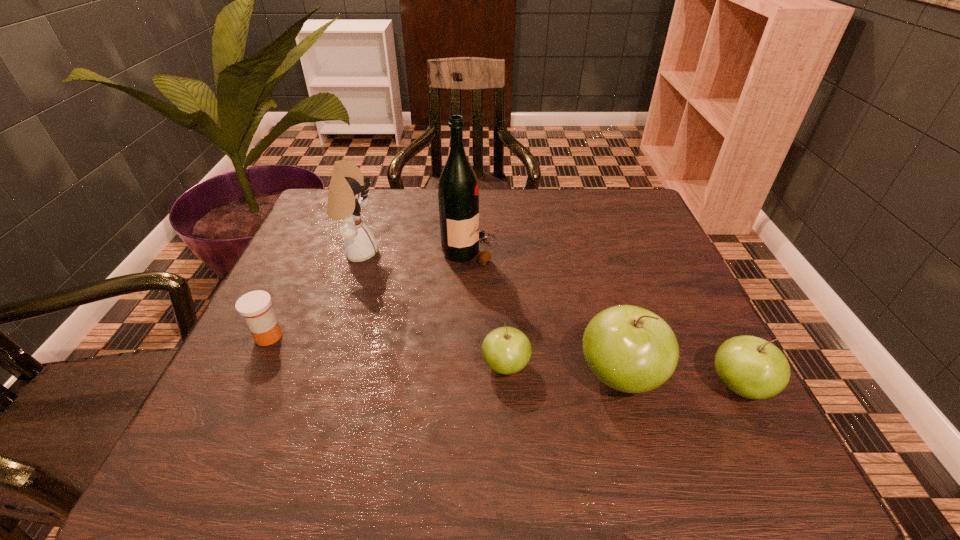
Where is `free spot that satisfies the following two spatial constraints: 1. at the front face of the third shortest object; 2. on the right side of the doll`? free spot that satisfies the following two spatial constraints: 1. at the front face of the third shortest object; 2. on the right side of the doll is located at coordinates [313, 387].

This screenshot has height=540, width=960. In order to click on vacant area in the image that satisfies the following two spatial constraints: 1. on the label of the medicine; 2. on the back side of the rightmost apple in this screenshot , I will do `click(245, 387)`.

This screenshot has width=960, height=540. I want to click on free location that satisfies the following two spatial constraints: 1. on the back side of the shortest apple; 2. on the label of the medicine, so pyautogui.click(x=504, y=336).

Identify the location of vacant space that satisfies the following two spatial constraints: 1. on the surface of the second tallest apple; 2. on the right side of the tallest object. (465, 387).

Find the location of a particular element. The height and width of the screenshot is (540, 960). vacant region that satisfies the following two spatial constraints: 1. on the back side of the rightmost object; 2. on the surface of the wine bottle is located at coordinates [668, 251].

The width and height of the screenshot is (960, 540). In order to click on vacant area that satisfies the following two spatial constraints: 1. on the back side of the third shortest object; 2. on the label of the medicine in this screenshot , I will do (x=712, y=336).

This screenshot has height=540, width=960. In order to click on vacant position in the image that satisfies the following two spatial constraints: 1. on the back side of the leftmost apple; 2. at the front face of the second object from left to right in this screenshot , I will do `click(499, 253)`.

At what (x,y) coordinates should I click in order to perform the action: click on vacant position in the image that satisfies the following two spatial constraints: 1. at the front face of the fifth object from right to left; 2. on the right side of the third tallest object. Please return your answer as a coordinate pair (x, y). The height and width of the screenshot is (540, 960). Looking at the image, I should click on (316, 376).